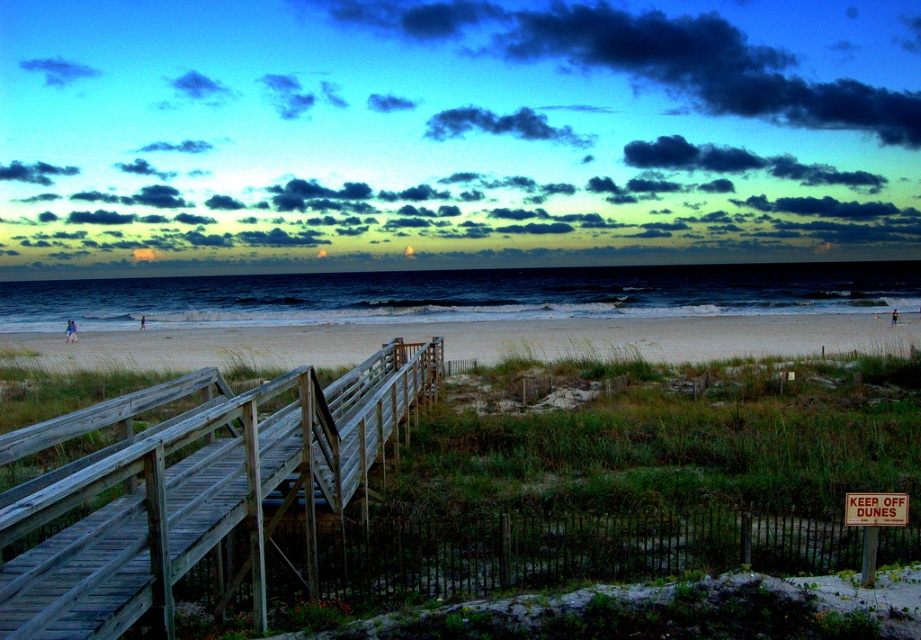
Is wooden rail at center to the right of white sand at center from the viewer's perspective?

Yes, wooden rail at center is to the right of white sand at center.

Is wooden rail at center smaller than white sand at center?

Answer: Indeed, wooden rail at center has a smaller size compared to white sand at center.

Is point (80, 488) farther from camera compared to point (200, 349)?

No, (80, 488) is in front of (200, 349).

Locate an element on the screen. Image resolution: width=921 pixels, height=640 pixels. wooden rail at center is located at coordinates (190, 488).